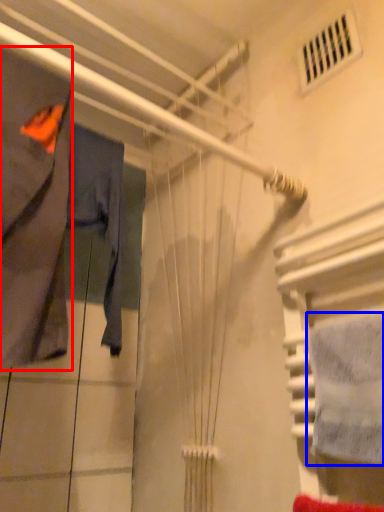
Question: Among these objects, which one is farthest to the camera, clothing (highlighted by a red box) or towel (highlighted by a blue box)?

Choices:
 (A) clothing
 (B) towel

Answer: (A)